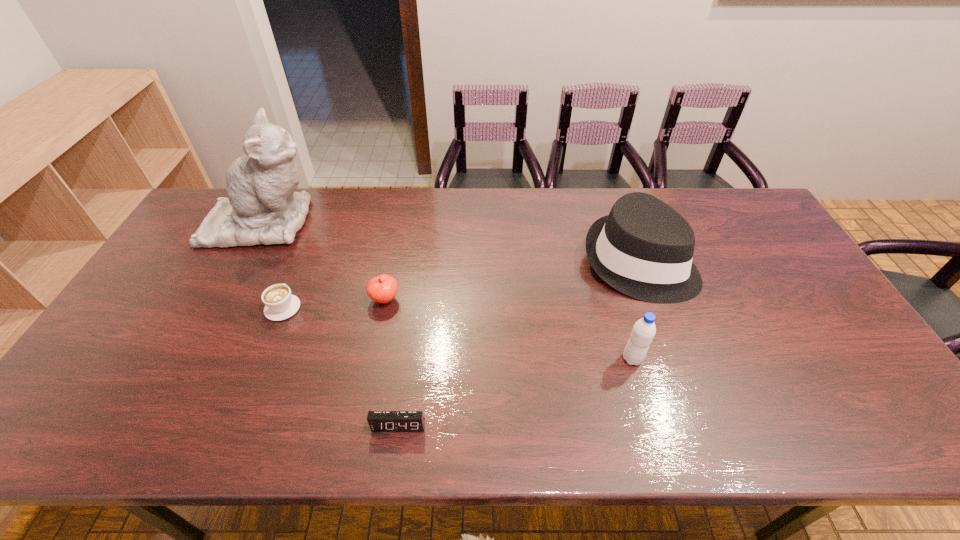
This screenshot has height=540, width=960. What are the coordinates of `cat` in the screenshot? It's located at [262, 208].

This screenshot has height=540, width=960. I want to click on fedora, so click(x=644, y=248).

You are a GUI agent. You are given a task and a screenshot of the screen. Output one action in this format:
    pyautogui.click(x=<x>, y=<y>)
    Task: Click on the second nearest object
    The width and height of the screenshot is (960, 540).
    Given the screenshot: What is the action you would take?
    (x=643, y=332)

Where is `the fourth tallest object`? Image resolution: width=960 pixels, height=540 pixels. the fourth tallest object is located at coordinates (383, 288).

Where is `cappuccino`? Image resolution: width=960 pixels, height=540 pixels. cappuccino is located at coordinates (280, 304).

Where is `alarm clock`? The width and height of the screenshot is (960, 540). alarm clock is located at coordinates click(379, 421).

Locate an element on the screen. free location located on the front-facing side of the cat is located at coordinates (377, 222).

Identify the location of vacant space located 0.180m on the left of the fedora. The image size is (960, 540). (524, 262).

Locate an element on the screen. The image size is (960, 540). vacant space situated 0.170m on the left of the second nearest object is located at coordinates coord(555,359).

Locate an element on the screen. Image resolution: width=960 pixels, height=540 pixels. free location located 0.330m on the front of the apple is located at coordinates (360, 426).